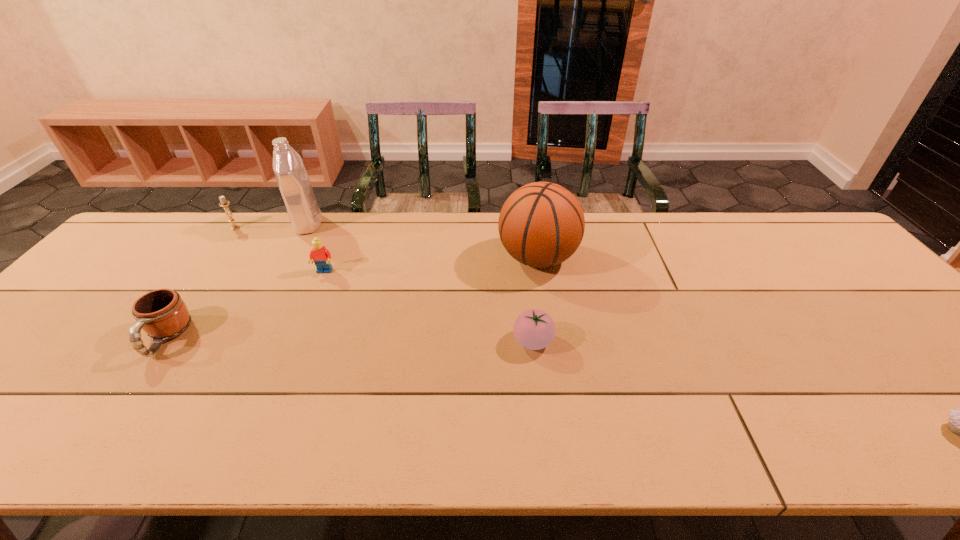
Where is `free spot between the candle holder and the mug`? free spot between the candle holder and the mug is located at coordinates (201, 282).

Identify the location of free space between the basketball and the mug. (351, 298).

In order to click on free spot between the third object from left to right and the mug in this screenshot , I will do `click(237, 281)`.

Locate an element on the screen. This screenshot has width=960, height=540. vacant space in between the candle holder and the tomato is located at coordinates (384, 285).

Find the location of a particular element. The height and width of the screenshot is (540, 960). vacant space in between the candle holder and the basketball is located at coordinates (386, 242).

Locate an element on the screen. vacant region between the candle holder and the mug is located at coordinates (201, 282).

Find the location of a particular element. This screenshot has height=540, width=960. the second closest object to the tallest object is located at coordinates (223, 203).

Choose which object is the fourth nearest neighbor to the sixth shortest object. Please provide its 2D coordinates. Your answer should be formatted as a tuple, i.e. [(x, y)], where the tuple contains the x and y coordinates of a point satisfying the conditions above.

[(959, 423)]